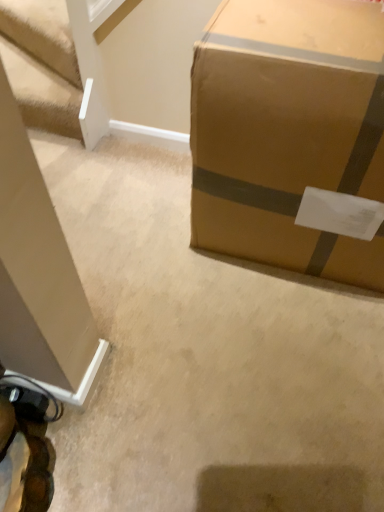
Identify the location of brown cardboard box at right. The image size is (384, 512). (288, 131).

The height and width of the screenshot is (512, 384). What do you see at coordinates (288, 131) in the screenshot?
I see `brown cardboard box at right` at bounding box center [288, 131].

Describe the element at coordinates (45, 67) in the screenshot. I see `white textured stairwell at upper left` at that location.

At what (x,y) coordinates should I click in order to perform the action: click on white textured stairwell at upper left. Please return your answer as a coordinate pair (x, y). Looking at the image, I should click on (45, 67).

The height and width of the screenshot is (512, 384). I want to click on brown cardboard box at right, so click(288, 131).

Between brown cardboard box at right and white textured stairwell at upper left, which one appears on the left side from the viewer's perspective?

white textured stairwell at upper left is more to the left.

From the picture: Relative to white textured stairwell at upper left, is brown cardboard box at right in front or behind?

brown cardboard box at right is in front of white textured stairwell at upper left.

Is point (296, 36) closer to viewer compared to point (49, 8)?

Yes, point (296, 36) is in front of point (49, 8).

From the image's perspective, is brown cardboard box at right beneath white textured stairwell at upper left?

Indeed, from the image's perspective, brown cardboard box at right is shown beneath white textured stairwell at upper left.

From a real-world perspective, between brown cardboard box at right and white textured stairwell at upper left, who is vertically higher?

brown cardboard box at right.

Considering the sizes of objects brown cardboard box at right and white textured stairwell at upper left in the image provided, who is wider, brown cardboard box at right or white textured stairwell at upper left?

white textured stairwell at upper left.

From their relative heights in the image, would you say brown cardboard box at right is taller or shorter than white textured stairwell at upper left?

Clearly, brown cardboard box at right is taller compared to white textured stairwell at upper left.

Considering the relative sizes of brown cardboard box at right and white textured stairwell at upper left in the image provided, is brown cardboard box at right smaller than white textured stairwell at upper left?

No, brown cardboard box at right is not smaller than white textured stairwell at upper left.

Would you say white textured stairwell at upper left is part of brown cardboard box at right's contents?

No, white textured stairwell at upper left is not inside brown cardboard box at right.

Are brown cardboard box at right and white textured stairwell at upper left far apart?

Actually, brown cardboard box at right and white textured stairwell at upper left are a little close together.

Is brown cardboard box at right oriented away from white textured stairwell at upper left?

No.

Measure the distance between brown cardboard box at right and white textured stairwell at upper left.

brown cardboard box at right is 39.18 inches from white textured stairwell at upper left.

Identify the location of stairwell that is above the brown cardboard box at right (from the image's perspective). (45, 67).

Which object is positioned more to the left, white textured stairwell at upper left or brown cardboard box at right?

white textured stairwell at upper left is more to the left.

Considering the positions of objects white textured stairwell at upper left and brown cardboard box at right in the image provided, who is behind, white textured stairwell at upper left or brown cardboard box at right?

white textured stairwell at upper left is more distant.

Between point (85, 87) and point (229, 203), which one is positioned in front?

The point (229, 203) is closer to the camera.

From the image's perspective, does white textured stairwell at upper left appear higher than brown cardboard box at right?

Yes.

From a real-world perspective, which is physically above, white textured stairwell at upper left or brown cardboard box at right?

brown cardboard box at right.

Between white textured stairwell at upper left and brown cardboard box at right, which one has larger width?

Wider between the two is white textured stairwell at upper left.

Considering the sizes of objects white textured stairwell at upper left and brown cardboard box at right in the image provided, who is shorter, white textured stairwell at upper left or brown cardboard box at right?

With less height is white textured stairwell at upper left.

Can you confirm if white textured stairwell at upper left is bigger than brown cardboard box at right?

Actually, white textured stairwell at upper left might be smaller than brown cardboard box at right.

Would you say white textured stairwell at upper left is inside or outside brown cardboard box at right?

white textured stairwell at upper left exists outside the volume of brown cardboard box at right.

Are white textured stairwell at upper left and brown cardboard box at right making contact?

They are not placed beside each other.

Is white textured stairwell at upper left aimed at brown cardboard box at right?

No, white textured stairwell at upper left is not aimed at brown cardboard box at right.

Identify the location of box that appears in front of the white textured stairwell at upper left. (288, 131).

Identify the location of stairwell above the brown cardboard box at right (from the image's perspective). The height and width of the screenshot is (512, 384). (45, 67).

Locate an element on the screen. This screenshot has width=384, height=512. box that appears below the white textured stairwell at upper left (from the image's perspective) is located at coordinates (288, 131).